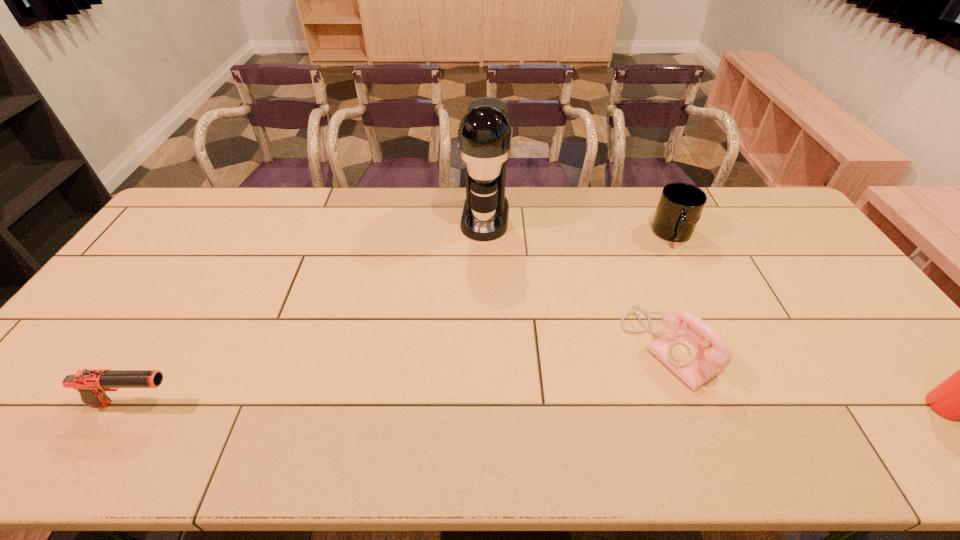
I want to click on free space located 0.200m on the dial of the third farthest object, so click(580, 410).

Locate an element on the screen. vacant space located 0.110m on the dial of the third farthest object is located at coordinates (608, 392).

I want to click on vacant space located 0.290m with the handle on the side of the mug, so click(648, 309).

The image size is (960, 540). Identify the location of vacant area situated 0.250m with the handle on the side of the mug. (652, 300).

The width and height of the screenshot is (960, 540). In order to click on free space located with the handle on the side of the mug in this screenshot , I will do `click(639, 332)`.

Image resolution: width=960 pixels, height=540 pixels. I want to click on coffee maker located at the far edge, so click(485, 133).

This screenshot has height=540, width=960. I want to click on mug positioned at the far edge, so coord(680,206).

You are a GUI agent. You are given a task and a screenshot of the screen. Output one action in this format:
    pyautogui.click(x=<x>, y=<y>)
    Task: Click on the gun present at the near edge
    This screenshot has width=960, height=540.
    Given the screenshot: What is the action you would take?
    pyautogui.click(x=91, y=384)

Find the location of a particular element. telephone at the near edge is located at coordinates (687, 349).

Image resolution: width=960 pixels, height=540 pixels. What are the coordinates of `vacant space at the far edge of the desktop` in the screenshot? It's located at (302, 187).